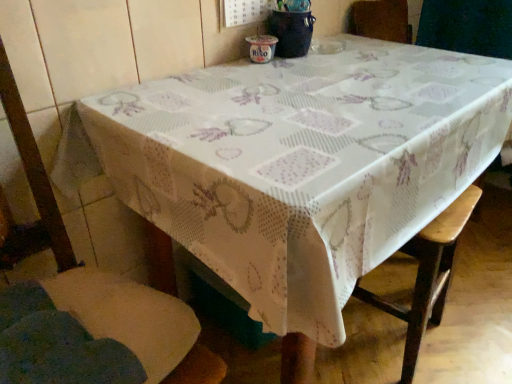
Question: From a real-world perspective, is wooden bar stool at lower right on top of wooden chair at lower left?

Choices:
 (A) yes
 (B) no

Answer: (B)

Question: Is wooden bar stool at lower right placed right next to wooden chair at lower left?

Choices:
 (A) no
 (B) yes

Answer: (A)

Question: From the image's perspective, is wooden bar stool at lower right below wooden chair at lower left?

Choices:
 (A) yes
 (B) no

Answer: (A)

Question: Is wooden bar stool at lower right positioned beyond the bounds of wooden chair at lower left?

Choices:
 (A) yes
 (B) no

Answer: (A)

Question: Is wooden bar stool at lower right bigger than wooden chair at lower left?

Choices:
 (A) no
 (B) yes

Answer: (A)

Question: Considering the relative positions of wooden bar stool at lower right and wooden chair at lower left in the image provided, is wooden bar stool at lower right to the right of wooden chair at lower left from the viewer's perspective?

Choices:
 (A) no
 (B) yes

Answer: (B)

Question: Can you confirm if wooden chair at lower left is wider than wooden bar stool at lower right?

Choices:
 (A) no
 (B) yes

Answer: (B)

Question: From a real-world perspective, is wooden chair at lower left below wooden bar stool at lower right?

Choices:
 (A) no
 (B) yes

Answer: (A)

Question: Is wooden chair at lower left not inside wooden bar stool at lower right?

Choices:
 (A) no
 (B) yes

Answer: (B)

Question: Considering the relative sizes of wooden chair at lower left and wooden bar stool at lower right in the image provided, is wooden chair at lower left bigger than wooden bar stool at lower right?

Choices:
 (A) no
 (B) yes

Answer: (B)

Question: Is wooden chair at lower left positioned behind wooden bar stool at lower right?

Choices:
 (A) no
 (B) yes

Answer: (A)

Question: Does wooden chair at lower left touch wooden bar stool at lower right?

Choices:
 (A) yes
 (B) no

Answer: (B)

Question: From a real-world perspective, is wooden bar stool at lower right physically located above or below wooden chair at lower left?

Choices:
 (A) below
 (B) above

Answer: (A)